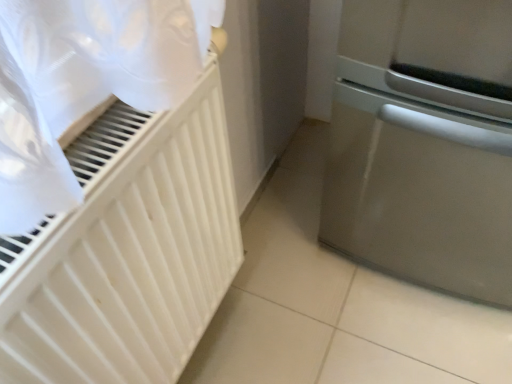
Question: In terms of width, does white matte radiator at left look wider or thinner when compared to satin silver dishwasher at right?

Choices:
 (A) wide
 (B) thin

Answer: (B)

Question: Is white matte radiator at left taller or shorter than satin silver dishwasher at right?

Choices:
 (A) tall
 (B) short

Answer: (B)

Question: Is white matte radiator at left inside or outside of satin silver dishwasher at right?

Choices:
 (A) outside
 (B) inside

Answer: (A)

Question: Is satin silver dishwasher at right in front of or behind white matte radiator at left in the image?

Choices:
 (A) behind
 (B) front

Answer: (A)

Question: Considering the positions of satin silver dishwasher at right and white matte radiator at left in the image, is satin silver dishwasher at right taller or shorter than white matte radiator at left?

Choices:
 (A) short
 (B) tall

Answer: (B)

Question: Is satin silver dishwasher at right inside the boundaries of white matte radiator at left, or outside?

Choices:
 (A) outside
 (B) inside

Answer: (A)

Question: In terms of size, does satin silver dishwasher at right appear bigger or smaller than white matte radiator at left?

Choices:
 (A) big
 (B) small

Answer: (A)